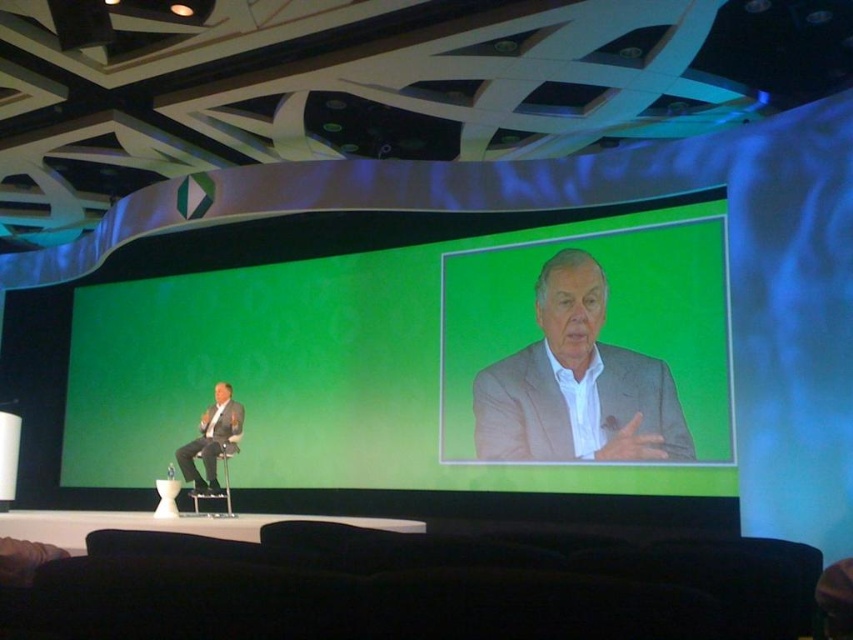
You are an event organizer and need to ensure that the matte gray suit at center and the metallic silver chair at left are visible to all audience members. Based on their sizes, which object might require strategic lighting to ensure visibility?

The matte gray suit at center has a smaller size compared to the metallic silver chair at left, so it might require strategic lighting to ensure visibility.

You are an event planner who needs to position a new speaker podium in the center of the stage. The stage has a green matte projection screen at center located at point (x=395, y=349). Where should you place the podium to ensure it is centered relative to the screen?

The podium should be placed at the same coordinates as the green matte projection screen at center, which is point (x=395, y=349), to ensure it is centered relative to the screen.